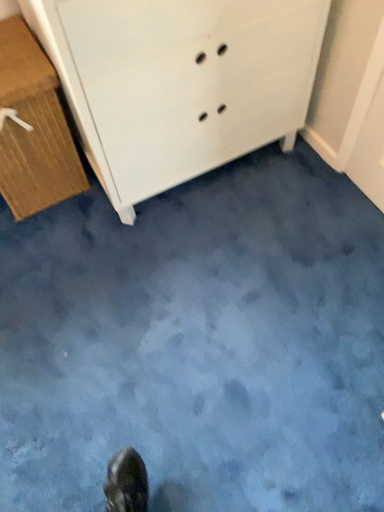
Question: Considering the relative positions of wooden chest of drawers at left, which is counted as the 2th chest of drawers, starting from the right, and white matte chest of drawers at upper center, which is the 2th chest of drawers in left-to-right order, in the image provided, is wooden chest of drawers at left, which is counted as the 2th chest of drawers, starting from the right, to the left or to the right of white matte chest of drawers at upper center, which is the 2th chest of drawers in left-to-right order,?

Choices:
 (A) right
 (B) left

Answer: (B)

Question: Is point (9, 201) positioned closer to the camera than point (120, 31)?

Choices:
 (A) closer
 (B) farther

Answer: (B)

Question: From the image's perspective, is wooden chest of drawers at left, which ranks as the 1th chest of drawers in left-to-right order, located above or below white matte chest of drawers at upper center, the first chest of drawers when ordered from right to left?

Choices:
 (A) below
 (B) above

Answer: (A)

Question: Based on their positions, is white matte chest of drawers at upper center, which is the 2th chest of drawers in left-to-right order, located to the left or right of wooden chest of drawers at left, which is counted as the 2th chest of drawers, starting from the right?

Choices:
 (A) right
 (B) left

Answer: (A)

Question: Based on their sizes in the image, would you say white matte chest of drawers at upper center, which is the 2th chest of drawers in left-to-right order, is bigger or smaller than wooden chest of drawers at left, which ranks as the 1th chest of drawers in left-to-right order?

Choices:
 (A) big
 (B) small

Answer: (A)

Question: In terms of width, does white matte chest of drawers at upper center, which is the 2th chest of drawers in left-to-right order, look wider or thinner when compared to wooden chest of drawers at left, which ranks as the 1th chest of drawers in left-to-right order?

Choices:
 (A) thin
 (B) wide

Answer: (B)

Question: Is point (132, 11) closer or farther from the camera than point (38, 92)?

Choices:
 (A) farther
 (B) closer

Answer: (B)